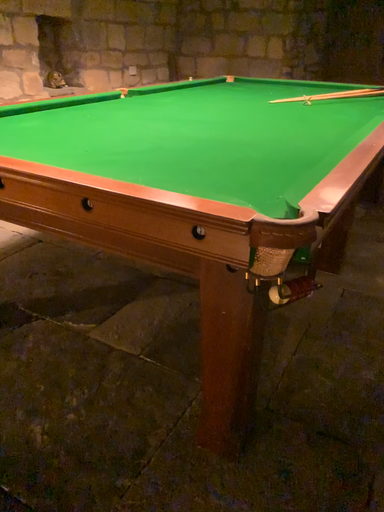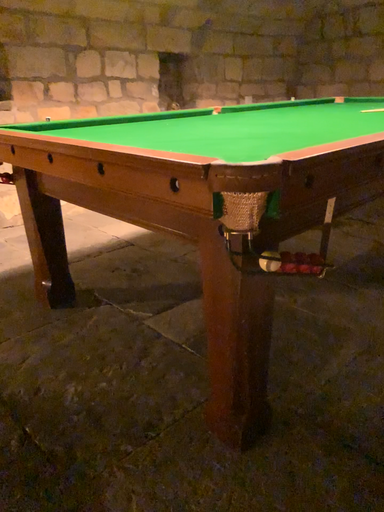
Question: How did the camera likely rotate when shooting the video?

Choices:
 (A) rotated left
 (B) rotated right

Answer: (A)